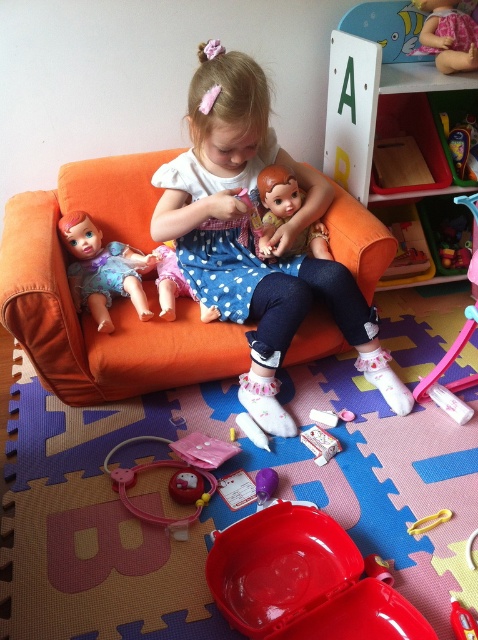
Who is more distant from viewer, [391,406] or [306,433]?

The point [391,406] is more distant.

Does white polka dot dress at center have a smaller size compared to white cardboard box at center?

No, white polka dot dress at center is not smaller than white cardboard box at center.

At what (x,y) coordinates should I click in order to perform the action: click on white polka dot dress at center. Please return your answer as a coordinate pair (x, y). Image resolution: width=478 pixels, height=640 pixels. Looking at the image, I should click on click(252, 240).

Is white polka dot dress at center taller than rubberized pink toy at lower center?

Yes, white polka dot dress at center is taller than rubberized pink toy at lower center.

Does white polka dot dress at center appear under rubberized pink toy at lower center?

No, white polka dot dress at center is not below rubberized pink toy at lower center.

Where is `white polka dot dress at center`? The image size is (478, 640). white polka dot dress at center is located at coordinates (252, 240).

Does point (216, 340) come in front of point (280, 536)?

No, (216, 340) is further to viewer.

Is orange fabric couch at center positioned behind smooth plastic bathtub at lower center?

Yes, it is.

Does point (324, 321) come farther from viewer compared to point (327, 564)?

Yes, point (324, 321) is farther from viewer.

Locate an element on the screen. orange fabric couch at center is located at coordinates (113, 304).